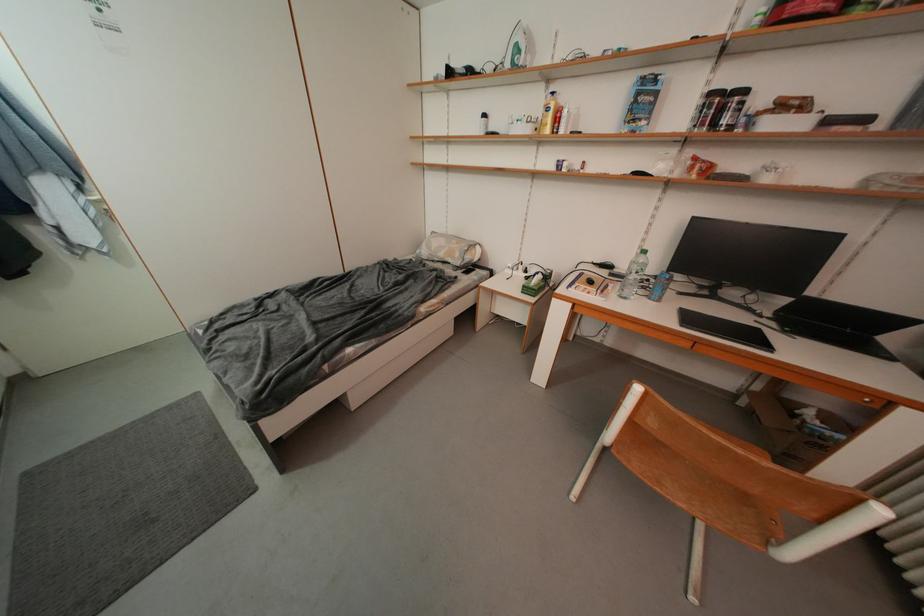
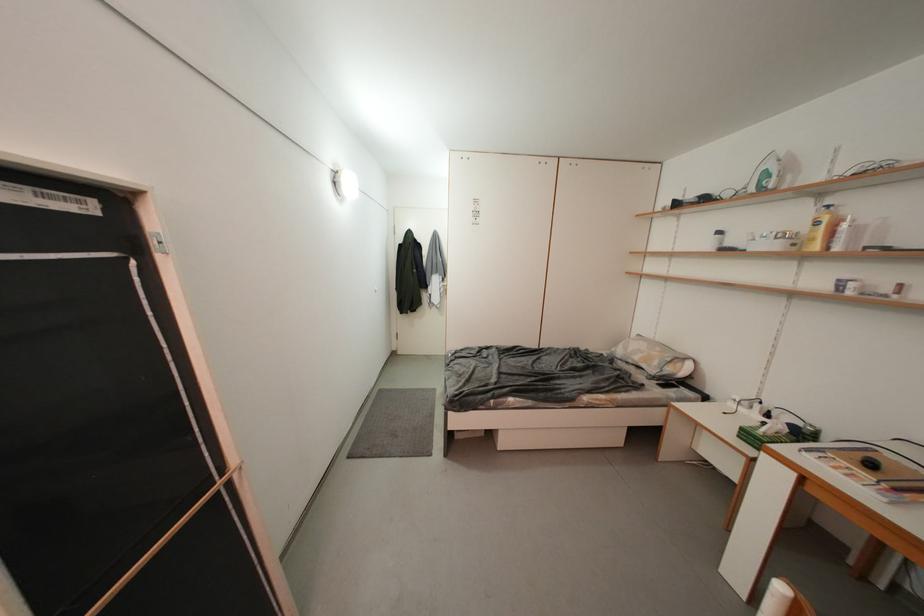
Question: How did the camera likely rotate?

Choices:
 (A) Left
 (B) Right
 (C) Up
 (D) Down

Answer: (A)